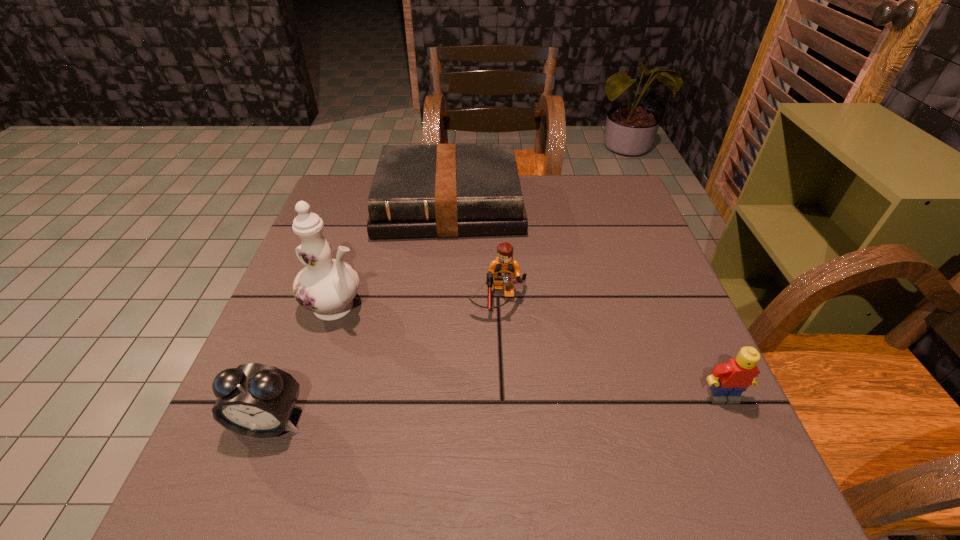
Locate an element on the screen. alarm clock at the left edge is located at coordinates (256, 400).

This screenshot has width=960, height=540. What are the coordinates of `hardback book that is positioned at the left edge` in the screenshot? It's located at (446, 190).

This screenshot has height=540, width=960. Identify the location of chinaware that is at the left edge. (326, 286).

At what (x,y) coordinates should I click in order to perform the action: click on object that is at the right edge. Please return your answer as a coordinate pair (x, y). This screenshot has height=540, width=960. Looking at the image, I should click on coord(728,381).

You are a GUI agent. You are given a task and a screenshot of the screen. Output one action in this format:
    pyautogui.click(x=<x>, y=<y>)
    Task: Click on the object present at the far left corner
    This screenshot has width=960, height=540.
    Given the screenshot: What is the action you would take?
    click(446, 190)

Where is `object positioned at the near left corner`? object positioned at the near left corner is located at coordinates (256, 400).

You are a GUI agent. You are given a task and a screenshot of the screen. Output one action in this format:
    pyautogui.click(x=<x>, y=<y>)
    Task: Click on the object that is at the near right corner
    The width and height of the screenshot is (960, 540).
    Given the screenshot: What is the action you would take?
    pyautogui.click(x=728, y=381)

Where is `vacant space at the far edge`? vacant space at the far edge is located at coordinates (555, 178).

Locate an element on the screen. The height and width of the screenshot is (540, 960). vacant space at the left edge of the desktop is located at coordinates (281, 300).

Image resolution: width=960 pixels, height=540 pixels. Find the location of `vacant area at the right edge`. vacant area at the right edge is located at coordinates (648, 376).